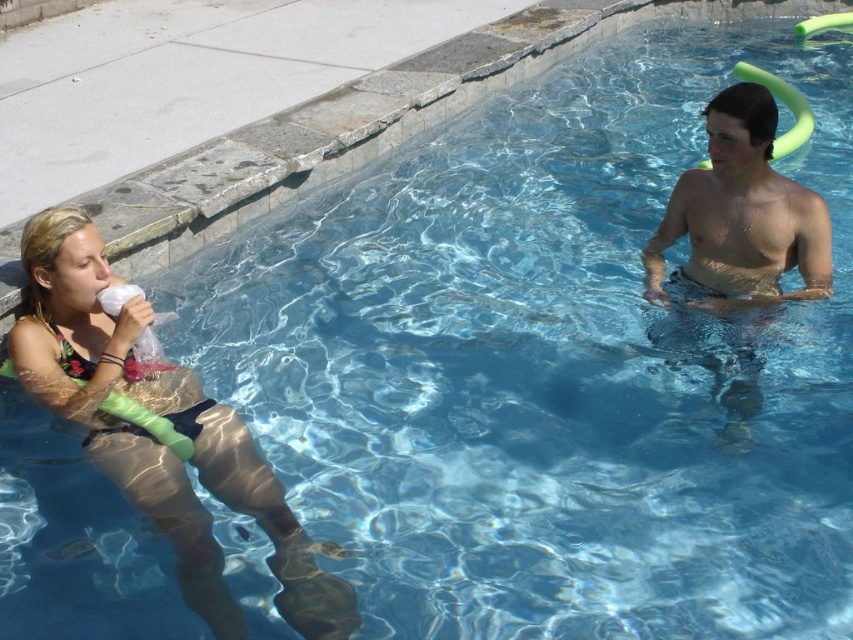
You are a swimmer who wants to reach the shiny brown skin at upper right from the matte green float at left. Which direction should you swim to get there?

The shiny brown skin at upper right is farther from the viewer than the matte green float at left, so you should swim away from the viewer to reach the shiny brown skin at upper right.

You are a lifeguard standing at the edge of the pool. You need to retrieve an item from the water. Which object would be easier to reach first, the matte green float at left or the shiny brown skin at upper right?

The matte green float at left is located below shiny brown skin at upper right, so the shiny brown skin at upper right is easier to reach first because it is closer to the surface.

Consider the image. You are a swimmer who wants to use the float that is closest to you. Which object should you choose between the matte green float at left and the shiny brown skin at upper right?

The shiny brown skin at upper right is closer to you since the matte green float at left has a larger size compared to it.